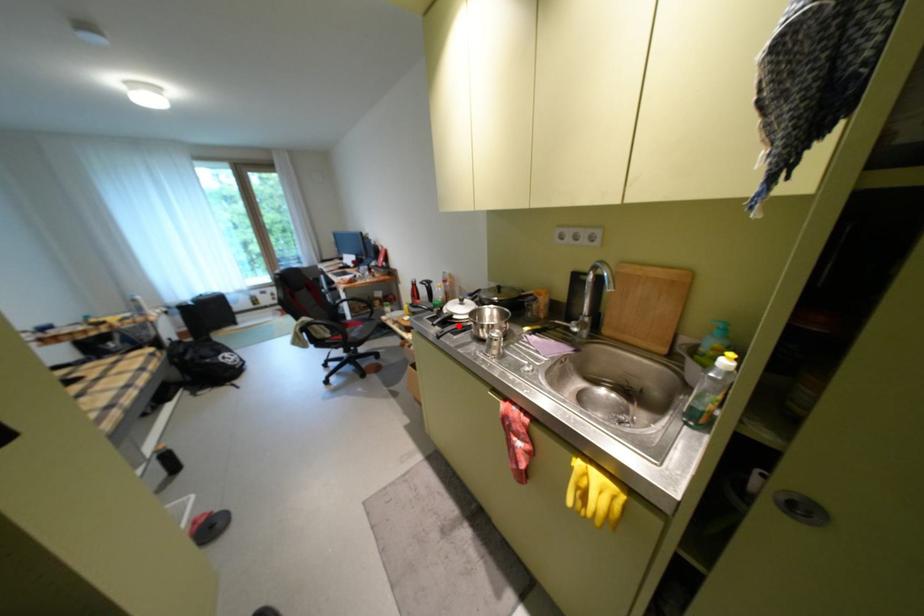
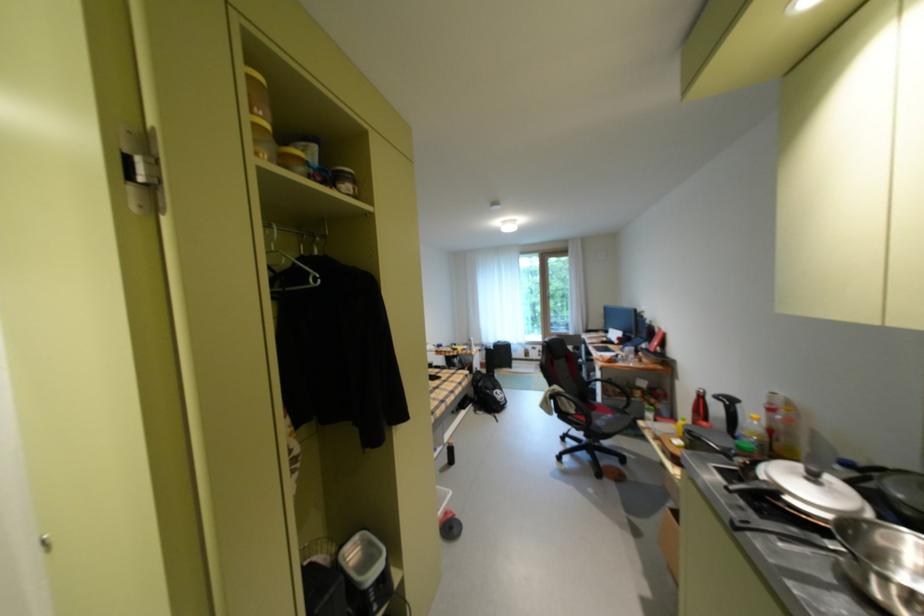
Find the pixel in the second image that matches the highlighted location in the first image.

(775, 507)